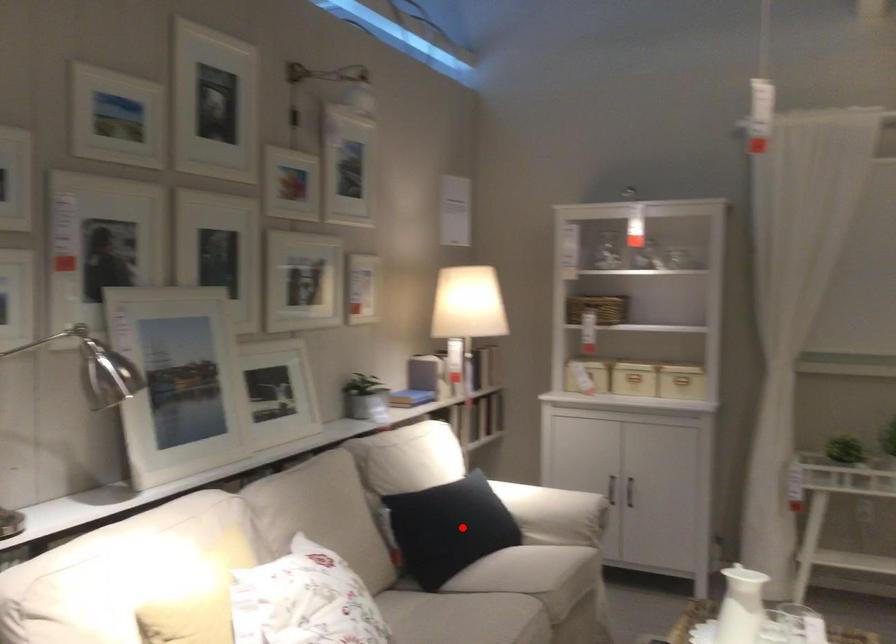
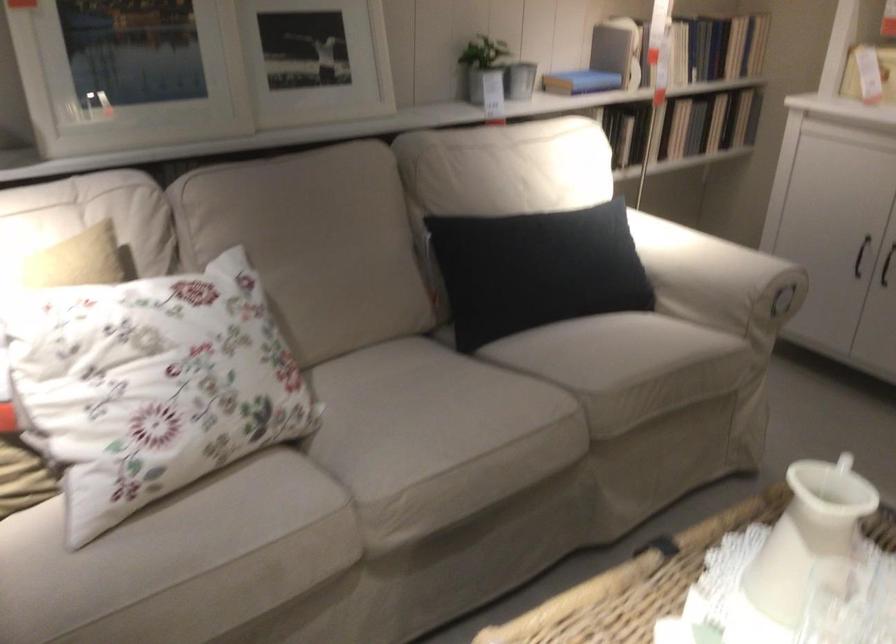
Question: I am providing you with two images of the same scene from different viewpoints. In image1, a red point is highlighted. Considering the same 3D point in image2, which of the following is correct?

Choices:
 (A) It is closer
 (B) It is farther

Answer: (A)